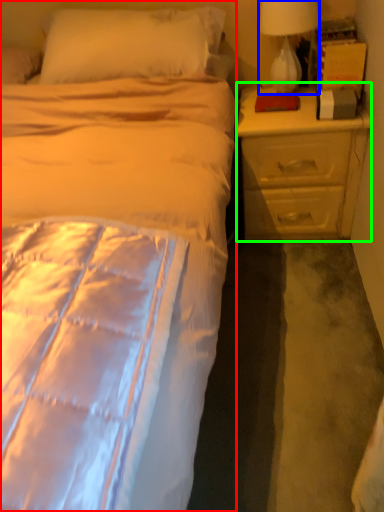
Question: Which is nearer to the bed (highlighted by a red box)? lamp (highlighted by a blue box) or nightstand (highlighted by a green box).

Choices:
 (A) lamp
 (B) nightstand

Answer: (B)